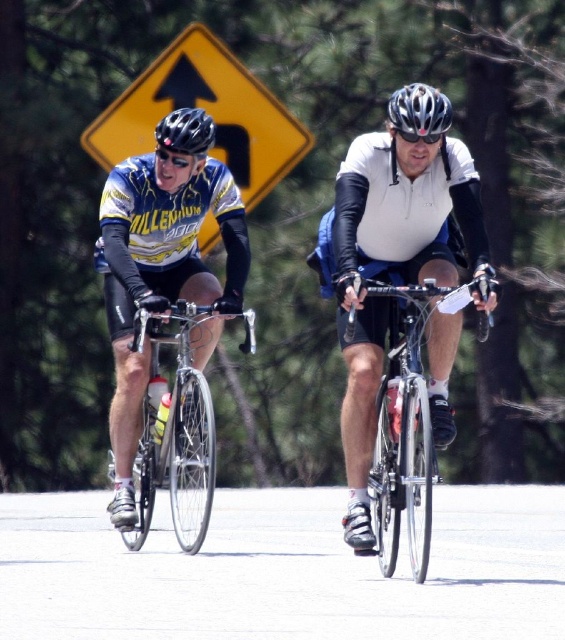
Question: Does silver metallic bicycle at center lie in front of matte black helmet at upper left?

Choices:
 (A) no
 (B) yes

Answer: (B)

Question: Which of the following is the closest to the observer?

Choices:
 (A) yellow/yellowish plastic sign at upper center
 (B) black matte bicycle helmet at center

Answer: (B)

Question: Which point is closer to the camera?

Choices:
 (A) (418, 125)
 (B) (123, 152)
 (C) (193, 547)

Answer: (A)

Question: Which of these objects is positioned farthest from the silver metallic bicycle at center?

Choices:
 (A) shiny silver bicycle at center
 (B) matte black helmet at upper left
 (C) yellow/yellowish plastic sign at upper center

Answer: (C)

Question: Does shiny silver bicycle at center appear over silver metallic bicycle at center?

Choices:
 (A) no
 (B) yes

Answer: (B)

Question: Does silver metallic bicycle at center come behind black matte bicycle helmet at center?

Choices:
 (A) yes
 (B) no

Answer: (A)